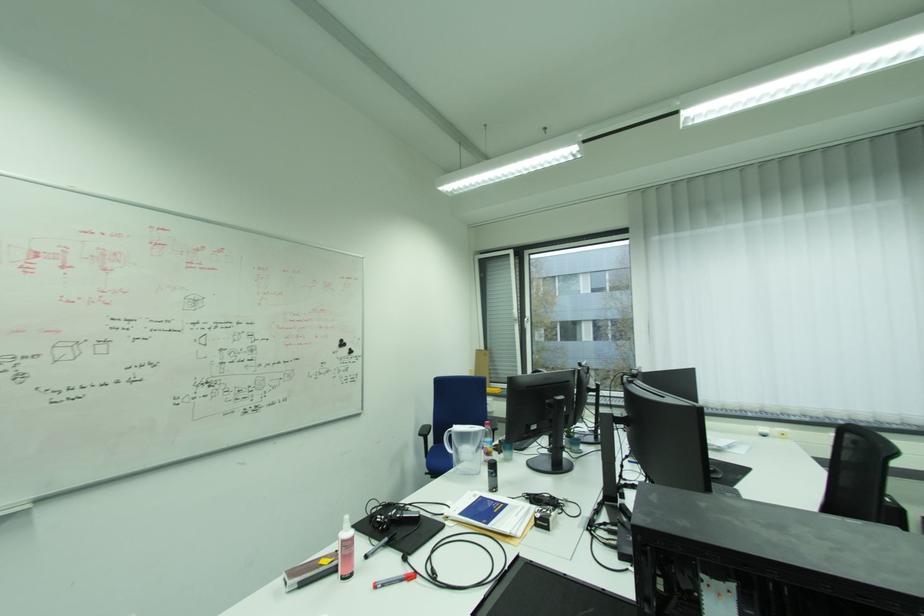
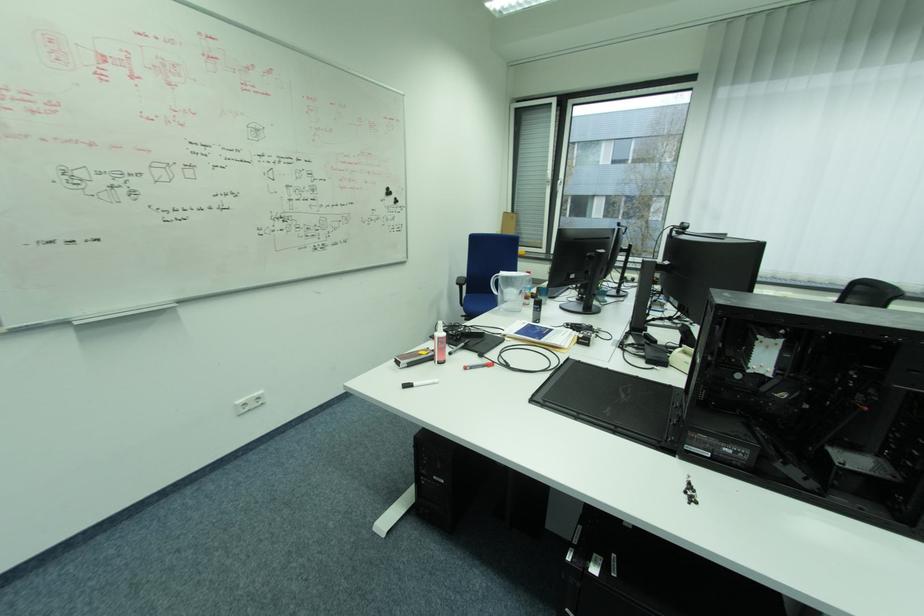
Locate, in the second image, the point that corresponds to point (346, 344) in the first image.

(392, 192)